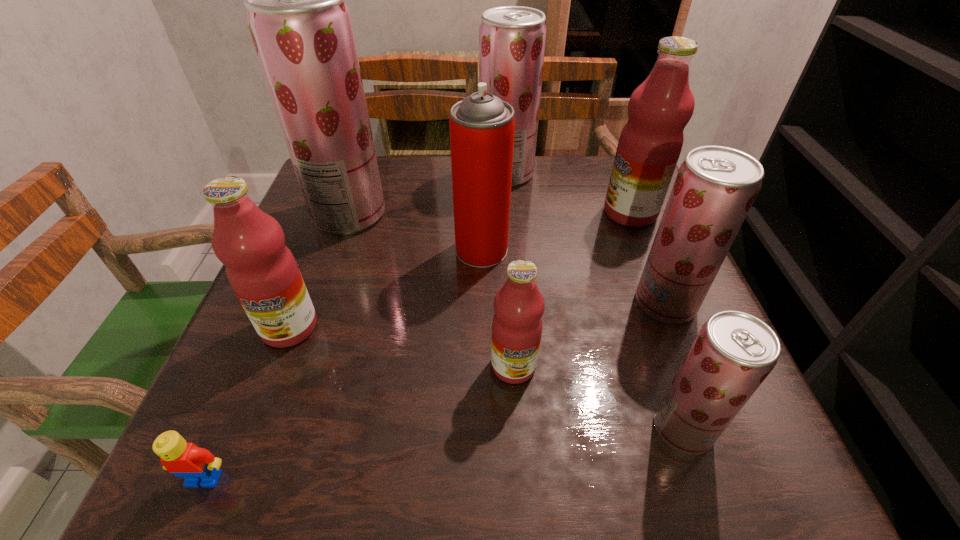
The width and height of the screenshot is (960, 540). Identify the location of the smallest strawberry fruit juice. (733, 353).

You are a GUI agent. You are given a task and a screenshot of the screen. Output one action in this format:
    pyautogui.click(x=<x>, y=<y>)
    Task: Click on the nearest fruit juice
    This screenshot has height=540, width=960.
    Given the screenshot: What is the action you would take?
    pyautogui.click(x=733, y=353)

In order to click on red Lego in this screenshot , I will do (x=198, y=466).

Where is `Lego`? This screenshot has width=960, height=540. Lego is located at coordinates (198, 466).

Where is `free space located 0.050m on the front of the tallest fruit juice`? This screenshot has width=960, height=540. free space located 0.050m on the front of the tallest fruit juice is located at coordinates (336, 252).

Locate an element on the screen. This screenshot has height=540, width=960. free space located on the left of the farthest fruit juice is located at coordinates (369, 174).

At what (x,y) coordinates should I click in order to perform the action: click on blank area located on the label of the biggest pink fruit juice. Please return your answer as a coordinate pair (x, y). The height and width of the screenshot is (540, 960). Looking at the image, I should click on (510, 212).

Where is `blank space located on the label of the biggest pink fruit juice`? The image size is (960, 540). blank space located on the label of the biggest pink fruit juice is located at coordinates (561, 212).

What are the coordinates of `free region located 0.180m on the label of the biggest pink fruit juice` in the screenshot? It's located at (527, 212).

Identify the location of free space located on the right of the aerosol can. (597, 250).